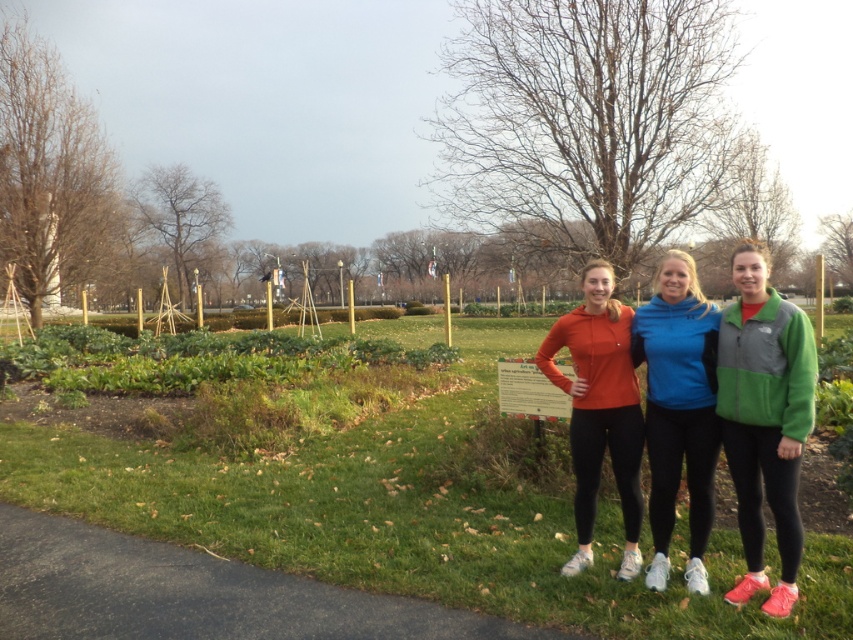
Which is more to the left, green grass at center or green fleece jacket at right?

Positioned to the left is green grass at center.

Can you confirm if green grass at center is wider than green fleece jacket at right?

Yes.

Does point (73, 468) lie behind point (740, 269)?

That is True.

What are the coordinates of `green grass at center` in the screenshot? It's located at (419, 513).

Does point (766, 472) come farther from viewer compared to point (636, 476)?

No, it is not.

Between green fleece jacket at right and matte orange hoodie at center, which one is positioned higher?

green fleece jacket at right

Between point (758, 513) and point (601, 292), which one is positioned behind?

The point (601, 292) is more distant.

Image resolution: width=853 pixels, height=640 pixels. Identify the location of green fleece jacket at right. (764, 419).

Who is more distant from viewer, [685,349] or [639,499]?

The point [639,499] is more distant.

Does blue fleece jacket at center have a lesser height compared to matte orange hoodie at center?

No.

Find the location of a particular element. blue fleece jacket at center is located at coordinates (677, 410).

Where is `blue fleece jacket at center`? Image resolution: width=853 pixels, height=640 pixels. blue fleece jacket at center is located at coordinates (677, 410).